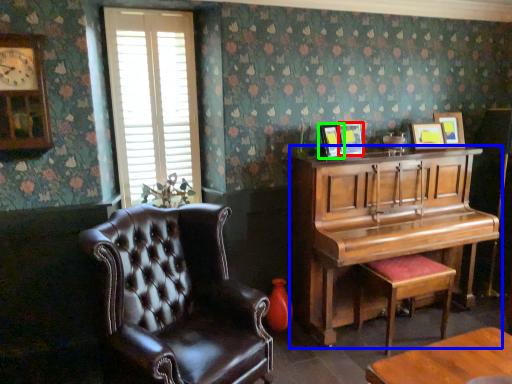
Question: Based on their relative distances, which object is farther from picture frame (highlighted by a red box)? Choose from piano (highlighted by a blue box) and picture frame (highlighted by a green box).

Choices:
 (A) piano
 (B) picture frame

Answer: (A)